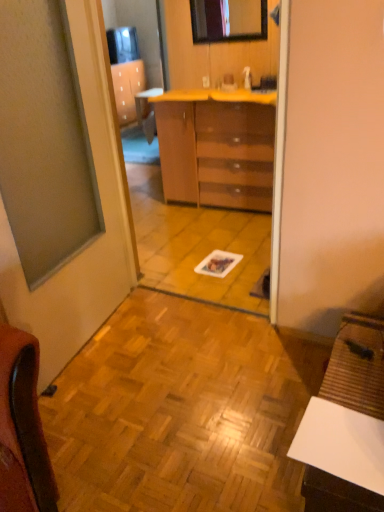
In order to face white matte desk at lower right, should I rotate leftwards or rightwards?

A 21.082 degree turn to the right will do.

The height and width of the screenshot is (512, 384). Find the location of `yellow laminate counter at center`. yellow laminate counter at center is located at coordinates pos(216,96).

Identify the location of matte glass window at left. The height and width of the screenshot is (512, 384). (44, 139).

At what (x,y) coordinates should I click in order to perform the action: click on glossy wooden mirror at upper center. Please return your answer as a coordinate pair (x, y). This screenshot has height=512, width=384. Looking at the image, I should click on (228, 20).

How different are the orientations of glossy wooden mirror at upper center and wooden parquet floor at center in degrees?

The facing directions of glossy wooden mirror at upper center and wooden parquet floor at center are 180 degrees apart.

Does glossy wooden mirror at upper center have a smaller size compared to wooden parquet floor at center?

Indeed, glossy wooden mirror at upper center has a smaller size compared to wooden parquet floor at center.

Does glossy wooden mirror at upper center have a lesser height compared to wooden parquet floor at center?

In fact, glossy wooden mirror at upper center may be taller than wooden parquet floor at center.

How much distance is there between glossy wooden mirror at upper center and wooden parquet floor at center?

A distance of 2.34 meters exists between glossy wooden mirror at upper center and wooden parquet floor at center.

From a real-world perspective, which is physically above, white matte desk at lower right or matte glass window at left?

matte glass window at left, from a real-world perspective.

In the scene shown: How far apart are white matte desk at lower right and matte glass window at left?

white matte desk at lower right and matte glass window at left are 1.29 meters apart from each other.

Is white matte desk at lower right oriented towards matte glass window at left?

No, white matte desk at lower right is not aimed at matte glass window at left.

Is white matte desk at lower right closer to camera compared to matte glass window at left?

Yes.

Which is more distant, (261, 408) or (265, 14)?

Point (265, 14)

Is glossy wooden mirror at upper center at the back of wooden parquet floor at center?

wooden parquet floor at center does not have its back to glossy wooden mirror at upper center.

Can you tell me how much wooden parquet floor at center and glossy wooden mirror at upper center differ in facing direction?

180 degrees separate the facing orientations of wooden parquet floor at center and glossy wooden mirror at upper center.

Is wooden parquet floor at center closer to camera compared to matte glass window at left?

No, it is behind matte glass window at left.

From a real-world perspective, does wooden parquet floor at center stand above matte glass window at left?

Actually, wooden parquet floor at center is physically below matte glass window at left in the real world.

Image resolution: width=384 pixels, height=512 pixels. In the image, there is a matte glass window at left. What are the coordinates of `tile below it (from a real-world perspective)` in the screenshot? It's located at (181, 411).

How different are the orientations of wooden parquet floor at center and matte glass window at left in degrees?

The angular difference between wooden parquet floor at center and matte glass window at left is 85.7 degrees.

Considering the relative sizes of wooden parquet floor at center and white matte desk at lower right in the image provided, is wooden parquet floor at center taller than white matte desk at lower right?

No.

Does wooden parquet floor at center have a greater width compared to white matte desk at lower right?

Indeed, wooden parquet floor at center has a greater width compared to white matte desk at lower right.

I want to click on desk located in front of the wooden parquet floor at center, so click(x=345, y=426).

Is wooden parquet floor at center in contact with white matte desk at lower right?

No, wooden parquet floor at center is not in contact with white matte desk at lower right.

Who is shorter, yellow laminate counter at center or glossy brown chest of drawers at center?

yellow laminate counter at center.

Which is farther from the camera, [169,96] or [194,153]?

The point [194,153] is farther from the camera.

Considering the sizes of yellow laminate counter at center and glossy brown chest of drawers at center in the image, is yellow laminate counter at center wider or thinner than glossy brown chest of drawers at center?

Clearly, yellow laminate counter at center has more width compared to glossy brown chest of drawers at center.

How different are the orientations of yellow laminate counter at center and glossy brown chest of drawers at center in degrees?

The facing directions of yellow laminate counter at center and glossy brown chest of drawers at center are 0.0296 degrees apart.

Considering the relative sizes of glossy wooden mirror at upper center and yellow laminate counter at center in the image provided, is glossy wooden mirror at upper center smaller than yellow laminate counter at center?

Yes, glossy wooden mirror at upper center is smaller than yellow laminate counter at center.

Is glossy wooden mirror at upper center taller than yellow laminate counter at center?

Indeed, glossy wooden mirror at upper center has a greater height compared to yellow laminate counter at center.

Is glossy wooden mirror at upper center inside the boundaries of yellow laminate counter at center, or outside?

The correct answer is: outside.

Find the location of a particular element. counter top in front of the glossy wooden mirror at upper center is located at coordinates (216, 96).

The height and width of the screenshot is (512, 384). What are the coordinates of `mirror that appears above the wooden parquet floor at center (from the image's perspective)` in the screenshot? It's located at (228, 20).

At what (x,y) coordinates should I click in order to perform the action: click on window on the left of the white matte desk at lower right. Please return your answer as a coordinate pair (x, y). Looking at the image, I should click on (44, 139).

Considering their positions, is yellow laminate counter at center positioned further to matte glass window at left than glossy brown chest of drawers at center?

The object further to matte glass window at left is yellow laminate counter at center.

In the scene shown: Which object lies further to the anchor point wooden parquet floor at center, white matte desk at lower right or yellow laminate counter at center?

yellow laminate counter at center.

Considering their positions, is matte glass window at left positioned closer to glossy brown chest of drawers at center than white matte desk at lower right?

matte glass window at left.

Based on their spatial positions, is yellow laminate counter at center or matte glass window at left further from wooden parquet floor at center?

The object further to wooden parquet floor at center is yellow laminate counter at center.

When comparing their distances from glossy brown chest of drawers at center, does wooden parquet floor at center or matte glass window at left seem further?

Among the two, wooden parquet floor at center is located further to glossy brown chest of drawers at center.

Which object lies further to the anchor point wooden parquet floor at center, glossy wooden mirror at upper center or white matte desk at lower right?

Among the two, glossy wooden mirror at upper center is located further to wooden parquet floor at center.

From the image, which object appears to be nearer to wooden parquet floor at center, glossy brown chest of drawers at center or glossy wooden mirror at upper center?

glossy brown chest of drawers at center.

Estimate the real-world distances between objects in this image. Which object is closer to white matte desk at lower right, wooden parquet floor at center or yellow laminate counter at center?

wooden parquet floor at center is closer to white matte desk at lower right.

I want to click on counter top between glossy wooden mirror at upper center and glossy brown chest of drawers at center in the up-down direction, so click(216, 96).

Image resolution: width=384 pixels, height=512 pixels. Find the location of `the chest of drawers that lies between glossy wooden mirror at upper center and wooden parquet floor at center from top to bottom`. the chest of drawers that lies between glossy wooden mirror at upper center and wooden parquet floor at center from top to bottom is located at coordinates (217, 147).

The image size is (384, 512). What are the coordinates of `counter top positioned between matte glass window at left and glossy wooden mirror at upper center from near to far` in the screenshot? It's located at (216, 96).

Locate an element on the screen. This screenshot has width=384, height=512. counter top positioned between wooden parquet floor at center and glossy brown chest of drawers at center from near to far is located at coordinates (216, 96).